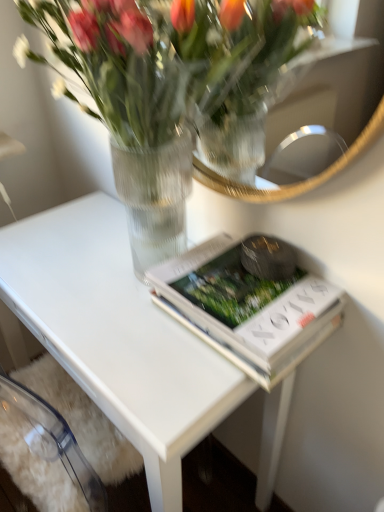
At what (x,y) coordinates should I click in order to perform the action: click on free point above white glossy table at center (from a real-world perspective). Please return your answer as a coordinate pair (x, y). This screenshot has height=512, width=384. Looking at the image, I should click on (96, 273).